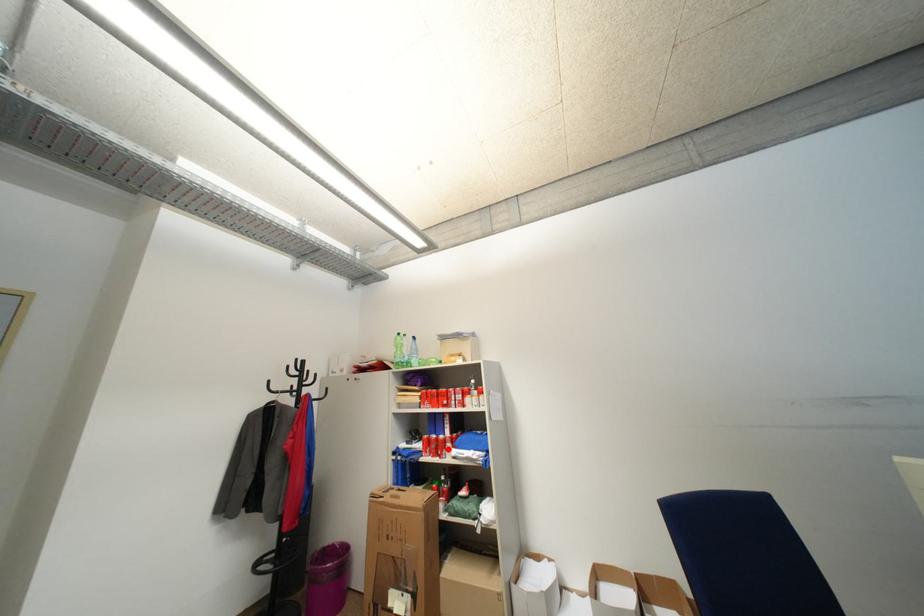
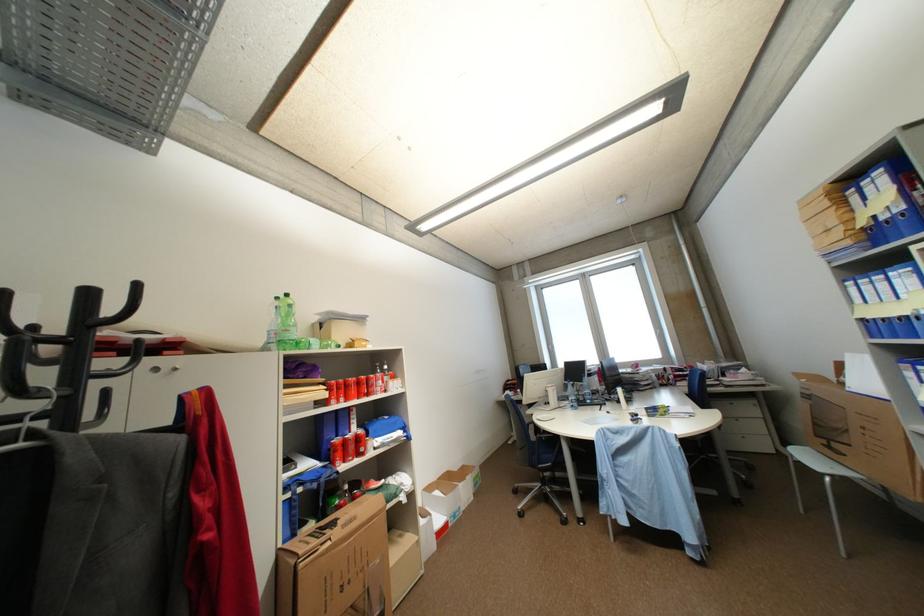
Question: I am providing you with two images of the same scene from different viewpoints. A red point is marked on the first image. Can you still see the location of the red point in image 2?

Choices:
 (A) Yes
 (B) No

Answer: (A)